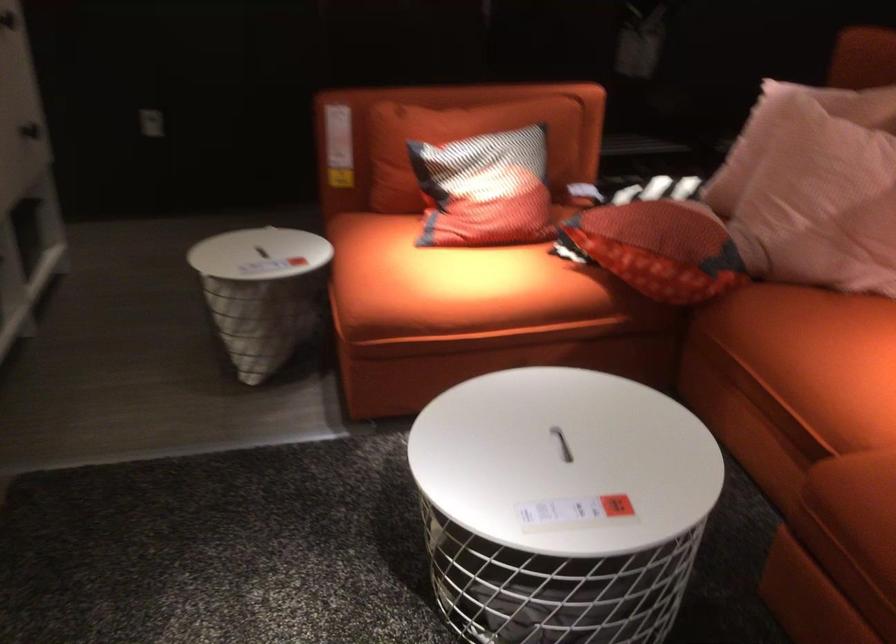
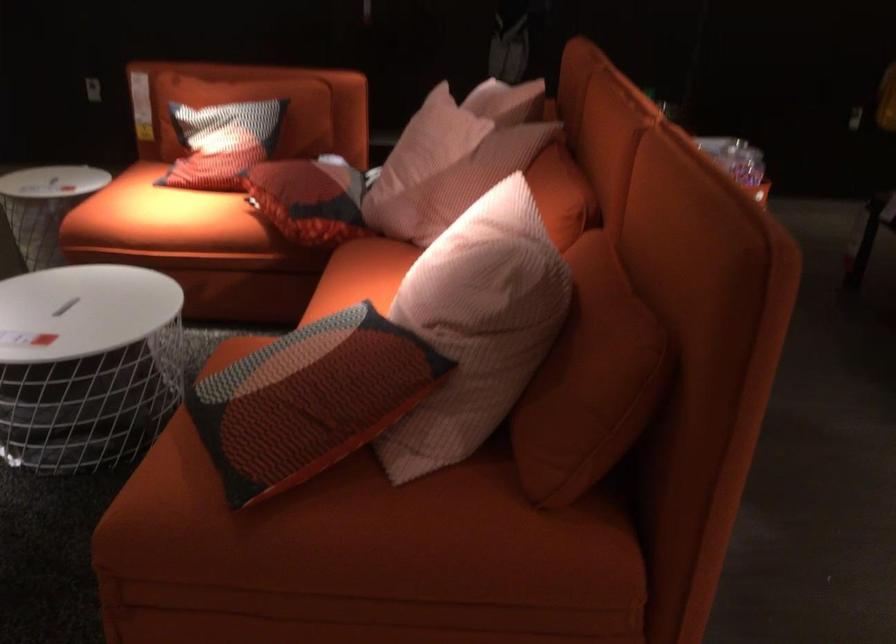
The point at [476,287] is marked in the first image. Where is the corresponding point in the second image?

(160, 216)